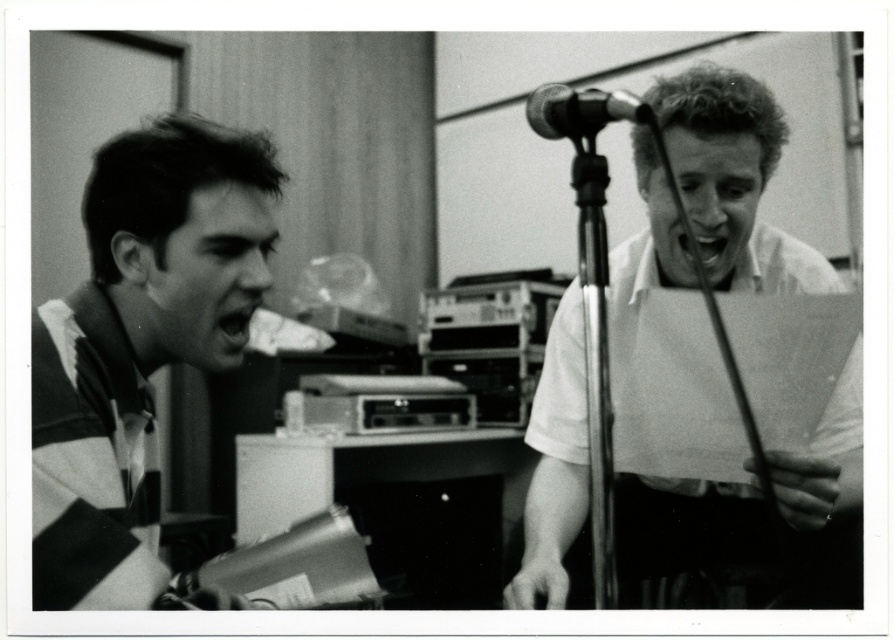
Question: Can you confirm if striped jersey at left is positioned below white paper at right?

Choices:
 (A) yes
 (B) no

Answer: (B)

Question: Based on their relative distances, which object is farther from the metallic/metallic microphone at center?

Choices:
 (A) striped jersey at left
 (B) white paper at right

Answer: (B)

Question: Is striped jersey at left bigger than white paper at right?

Choices:
 (A) yes
 (B) no

Answer: (B)

Question: Which is nearer to the striped jersey at left?

Choices:
 (A) white paper at right
 (B) metallic/metallic microphone at center

Answer: (B)

Question: Is striped jersey at left closer to camera compared to metallic/metallic microphone at center?

Choices:
 (A) no
 (B) yes

Answer: (B)

Question: Which point appears farthest from the camera in this image?

Choices:
 (A) (224, 356)
 (B) (591, 129)
 (C) (571, 308)

Answer: (C)